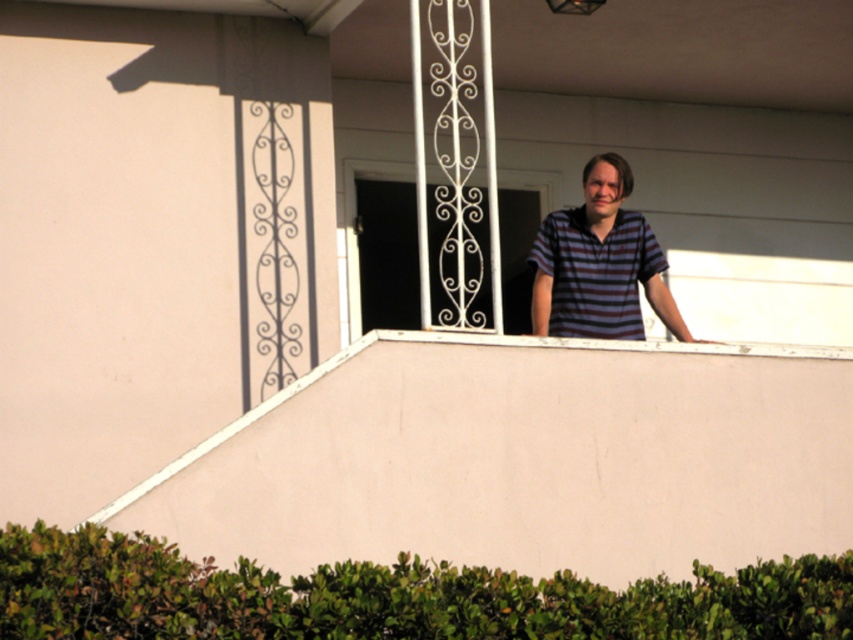
Can you confirm if pink matte balcony at upper center is bigger than white wrought iron at upper center?

Indeed, pink matte balcony at upper center has a larger size compared to white wrought iron at upper center.

Who is more forward, (701,412) or (350,321)?

Positioned in front is point (701,412).

The height and width of the screenshot is (640, 853). What are the coordinates of `pink matte balcony at upper center` in the screenshot? It's located at (523, 458).

Is striped cotton shirt at upper center to the left of white wrought iron at upper center from the viewer's perspective?

Incorrect, striped cotton shirt at upper center is not on the left side of white wrought iron at upper center.

Is striped cotton shirt at upper center thinner than white wrought iron at upper center?

In fact, striped cotton shirt at upper center might be wider than white wrought iron at upper center.

Is point (563, 259) closer to viewer compared to point (357, 284)?

Yes.

Find the location of `striped cotton shirt at upper center`. striped cotton shirt at upper center is located at coordinates (599, 262).

Does pink matte balcony at upper center have a larger size compared to striped cotton shirt at upper center?

Indeed, pink matte balcony at upper center has a larger size compared to striped cotton shirt at upper center.

Is point (384, 484) positioned behind point (550, 237)?

No, (384, 484) is in front of (550, 237).

Is point (618, 449) farther from viewer compared to point (624, 218)?

No.

Locate an element on the screen. The image size is (853, 640). pink matte balcony at upper center is located at coordinates (523, 458).